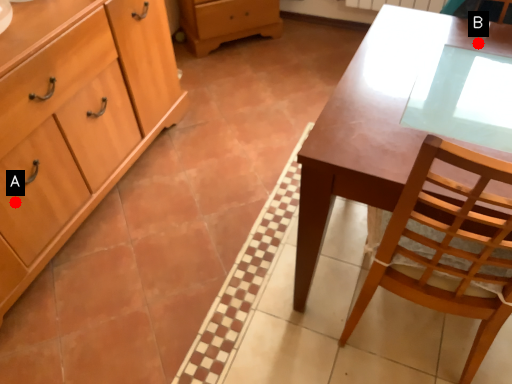
Question: Two points are circled on the image, labeled by A and B beside each circle. Which point appears farthest from the camera in this image?

Choices:
 (A) A is further
 (B) B is further

Answer: (A)